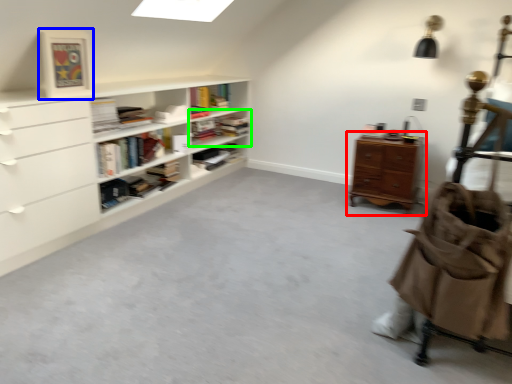
Question: Considering the real-world distances, which object is farthest from chest of drawers (highlighted by a red box)? picture frame (highlighted by a blue box) or shelf (highlighted by a green box)?

Choices:
 (A) picture frame
 (B) shelf

Answer: (A)